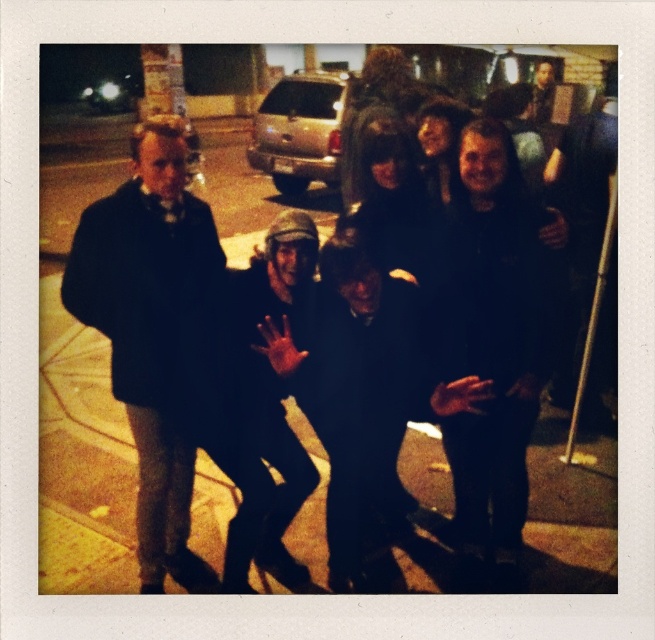
Looking at this image, which is above, dark wool coat at left or black fuzzy jacket at center?

dark wool coat at left is above.

Does dark wool coat at left have a lesser width compared to black fuzzy jacket at center?

Incorrect, dark wool coat at left's width is not less than black fuzzy jacket at center's.

Find the location of a particular element. This screenshot has height=640, width=655. dark wool coat at left is located at coordinates (155, 332).

Find the location of a particular element. dark wool coat at left is located at coordinates (155, 332).

Which of these two, dark brown leather jacket at center or dark gray knit hat at center, stands shorter?

dark brown leather jacket at center is shorter.

Who is more forward, (419, 403) or (265, 396)?

Point (265, 396) is more forward.

Is point (346, 438) closer to camera compared to point (231, 467)?

No, (346, 438) is behind (231, 467).

The image size is (655, 640). Identify the location of dark brown leather jacket at center. (358, 384).

Based on the photo, which of these two, black fuzzy jacket at center or dark gray knit hat at center, stands shorter?

With less height is dark gray knit hat at center.

Is black fuzzy jacket at center above dark gray knit hat at center?

Yes, black fuzzy jacket at center is above dark gray knit hat at center.

Is point (514, 513) behind point (282, 493)?

Yes, it is behind point (282, 493).

Where is `black fuzzy jacket at center`? Image resolution: width=655 pixels, height=640 pixels. black fuzzy jacket at center is located at coordinates (495, 337).